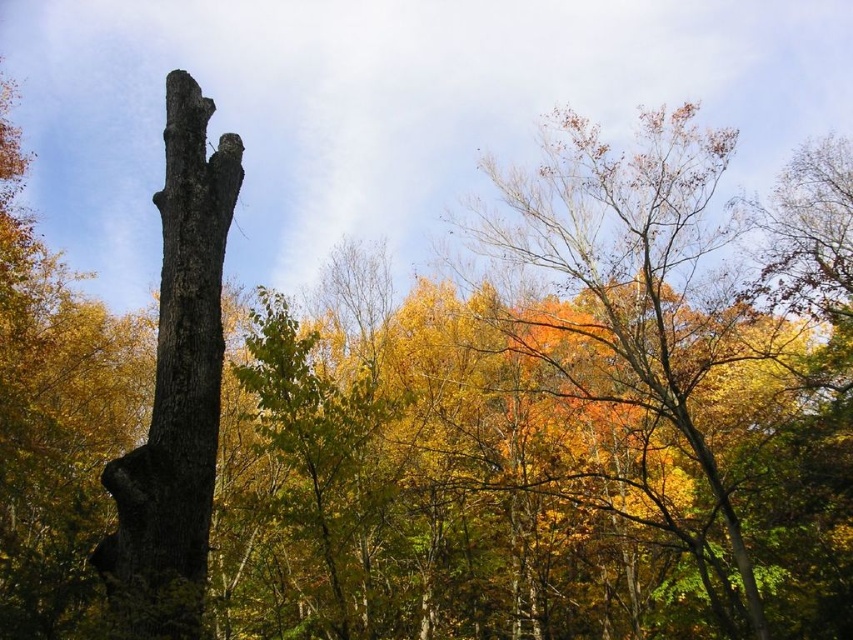
Is orange-brown bark tree at upper right smaller than smooth bark tree trunk at left?

Actually, orange-brown bark tree at upper right might be larger than smooth bark tree trunk at left.

Which is behind, point (498, 256) or point (163, 493)?

The point (498, 256) is behind.

Find the location of a particular element. orange-brown bark tree at upper right is located at coordinates 628,284.